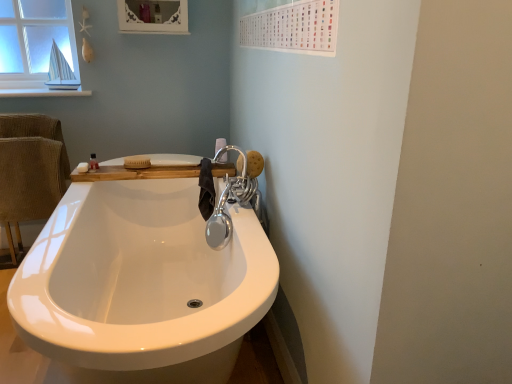
Identify the location of empty space that is ontop of woodenmaterial/texturecounter top at upper center (from a real-world perspective). (154, 160).